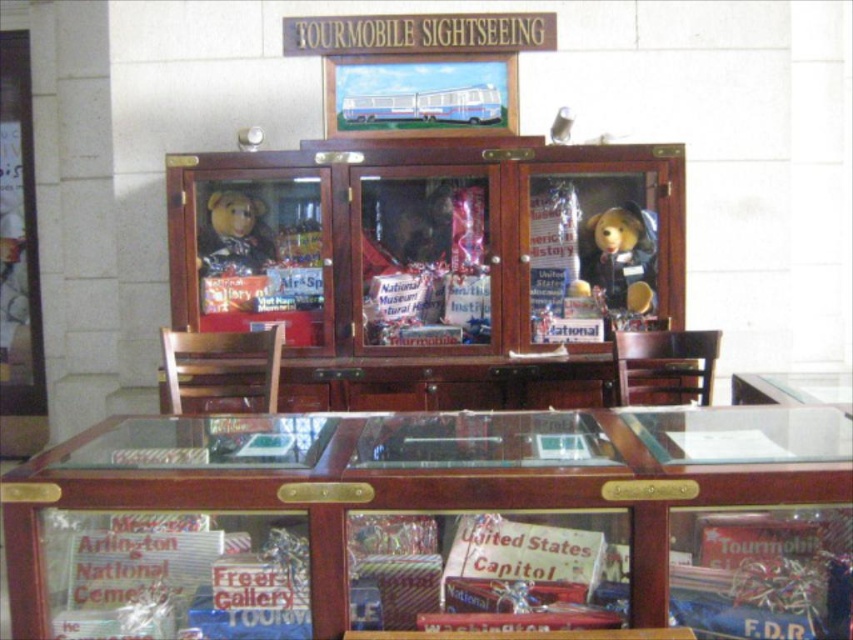
Does point (635, 314) come behind point (201, 237)?

That is False.

Is point (621, 230) closer to viewer compared to point (216, 189)?

Yes, it is in front of point (216, 189).

Find the location of a particular element. The image size is (853, 640). matte brown teddy bear at right is located at coordinates (619, 259).